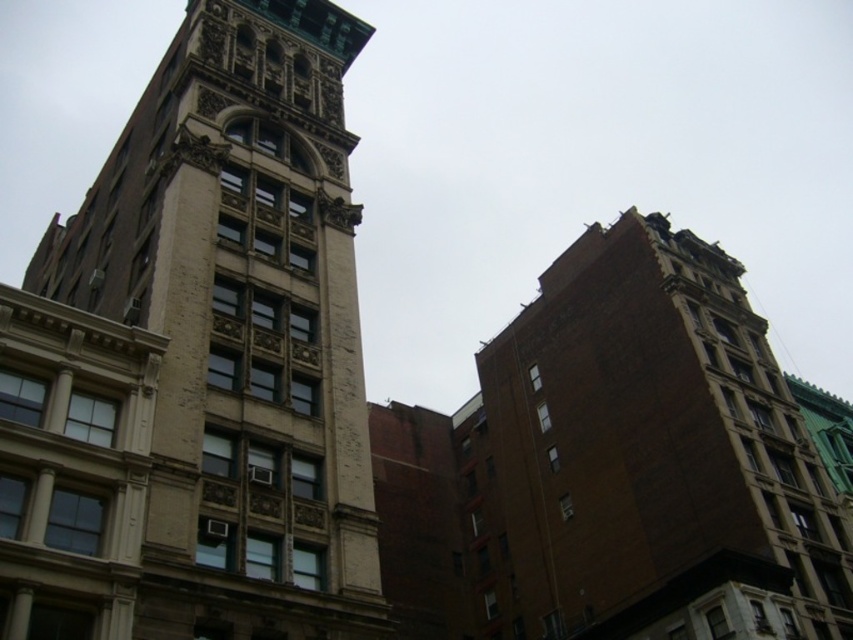
Between white stone tower at center and brown brick tower at right, which one is positioned lower?

brown brick tower at right is below.

Does point (339, 403) come in front of point (634, 298)?

Yes, it is in front of point (634, 298).

Is point (144, 577) positioned in front of point (821, 630)?

Yes, point (144, 577) is closer to viewer.

Locate an element on the screen. This screenshot has height=640, width=853. white stone tower at center is located at coordinates pyautogui.click(x=202, y=356).